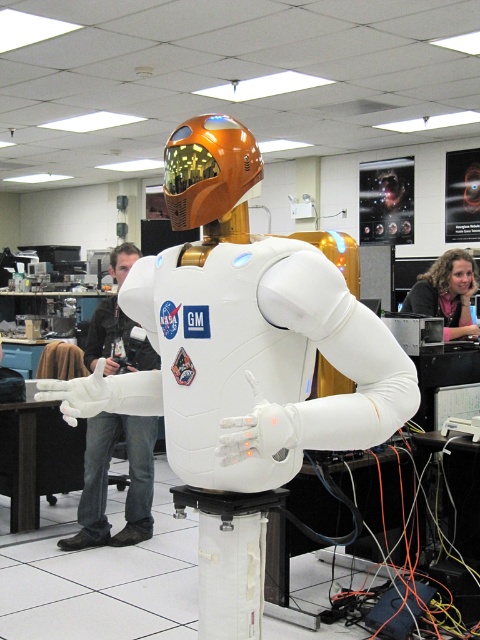
You are a technician in a lab. You need to reach the white matte astronaut at center. The lab has a 1.2 meter wide equipment cart. Can the cart fit through the space between you and the astronaut?

The white matte astronaut at center is 1.28 meters away from the camera. Since the equipment cart is 1.2 meters wide, it can fit through the space as the distance is slightly larger than the cart width.

You are navigating a robotic arm in the laboratory to place an object. The white matte astronaut at center is currently at point 0.527, 0.506. If the robotic arm needs to move the astronaut to point 0.6, 0.6, which direction should it move?

The white matte astronaut at center should be moved northeast to reach the new coordinates.

You are a technician in a lab and need to reach an object. You see jeans at left and pink fabric at upper right. Which one is taller?

The jeans at left is much taller than the pink fabric at upper right.